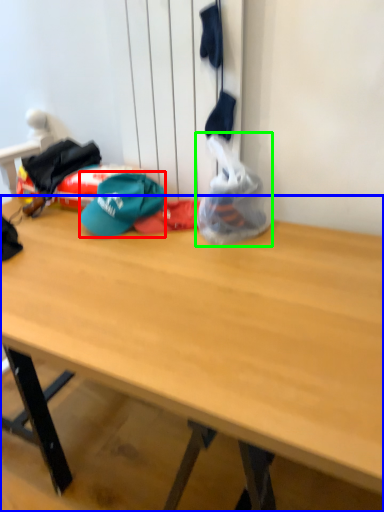
Question: Based on their relative distances, which object is nearer to hat (highlighted by a red box)? Choose from desk (highlighted by a blue box) and plastic bag (highlighted by a green box).

Choices:
 (A) desk
 (B) plastic bag

Answer: (B)